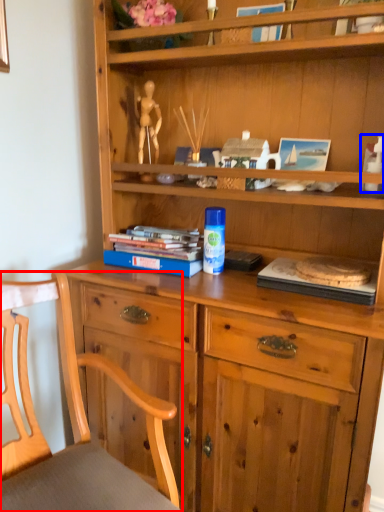
Question: Which of the following is the farthest to the observer, chair (highlighted by a red box) or toy (highlighted by a blue box)?

Choices:
 (A) chair
 (B) toy

Answer: (B)